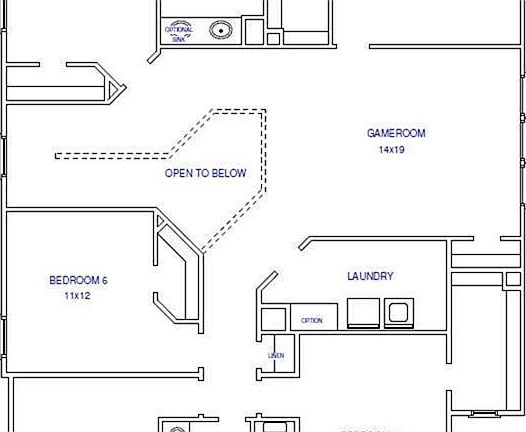
The width and height of the screenshot is (526, 432). I want to click on room, so click(97, 27).